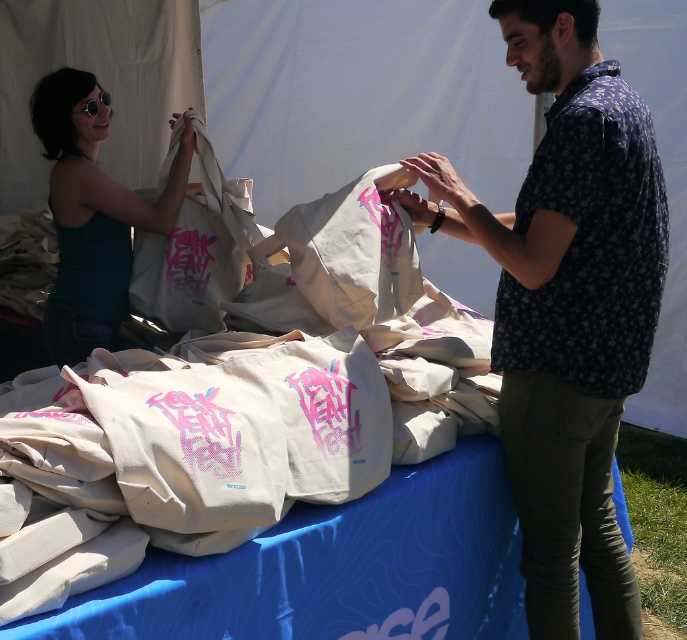
You are standing at the entrance of the tent and want to walk towards the two points marked in the image. Which point, point [633,145] or point [91,166], will you reach first?

Point [633,145] is closer to the viewer than point [91,166], so you will reach point [633,145] first.

You are a festival attendee who wants to grab a tote bag from the table. The floral shirt at center and the matte white tote bag at left are on the table. Which one is closer to your right hand if you are facing the table?

The floral shirt at center is to the right of the matte white tote bag at left, so the floral shirt at center is closer to your right hand.

You are a photographer at the Funk Yeah Fest event. You need to take a photo of the floral shirt at center and the matte white tote bag at left. Can you see both objects clearly in the same photo without moving the camera?

Yes, the floral shirt at center is in front of the matte white tote bag at left, so both can be captured in the same photo without moving the camera.